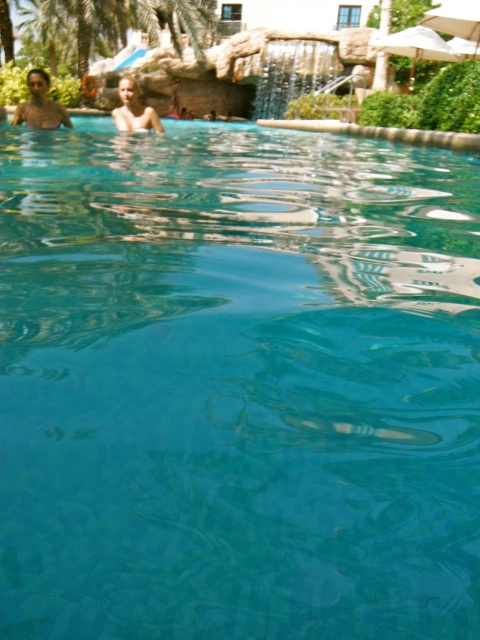
Is matte skin at upper left above blonde hair human at upper left?

No, matte skin at upper left is not above blonde hair human at upper left.

Between point (45, 113) and point (146, 122), which one is positioned behind?

Point (146, 122)

Image resolution: width=480 pixels, height=640 pixels. I want to click on matte skin at upper left, so click(39, 104).